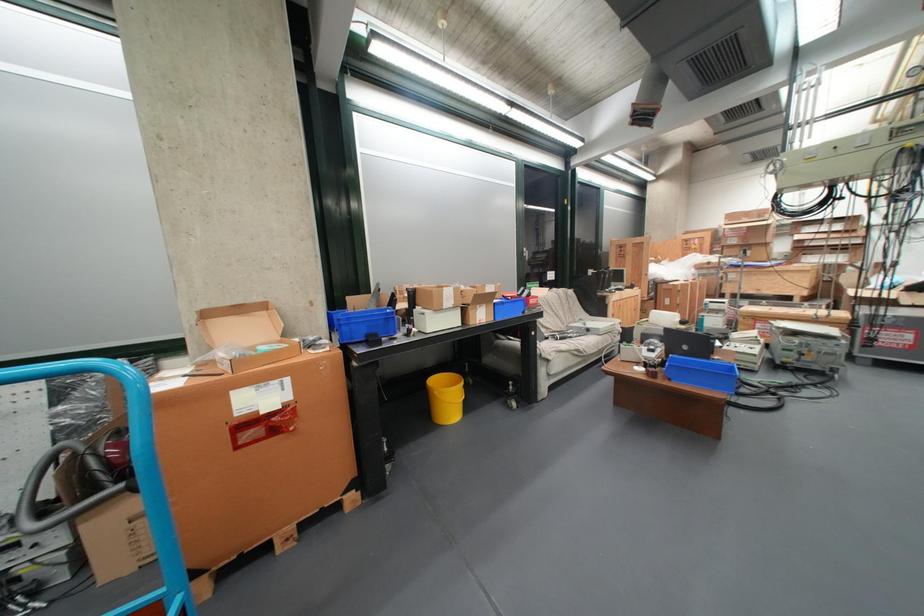
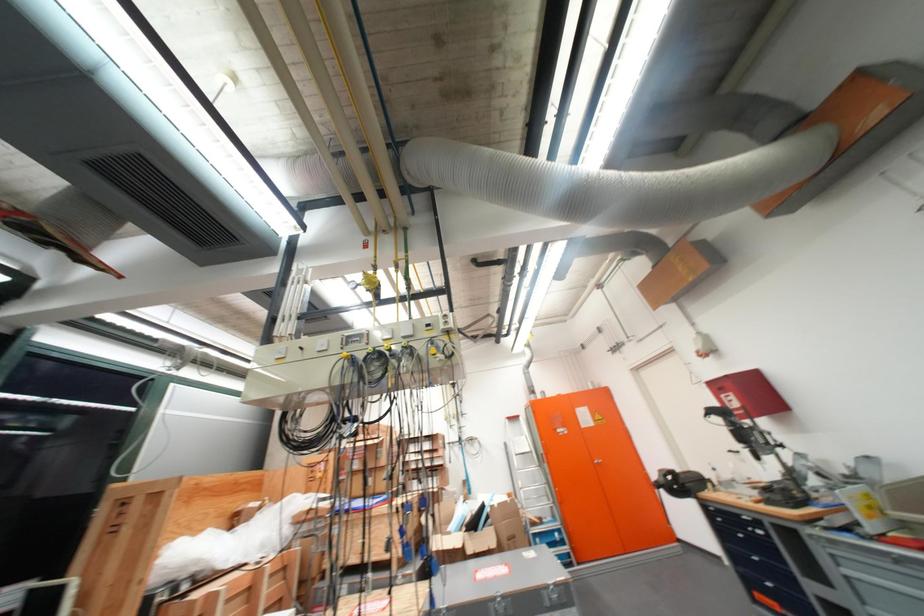
The point at (845, 309) is marked in the first image. Where is the corresponding point in the second image?

(438, 573)